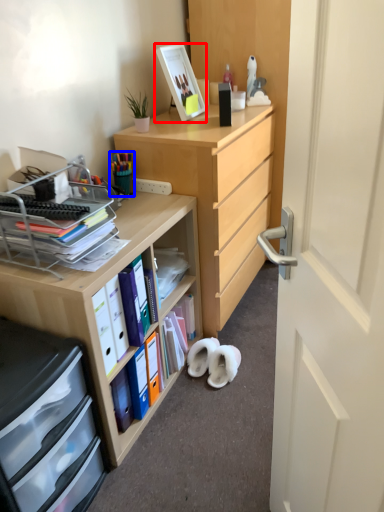
Question: Among these objects, which one is farthest to the camera, picture frame (highlighted by a red box) or stationery (highlighted by a blue box)?

Choices:
 (A) picture frame
 (B) stationery

Answer: (A)